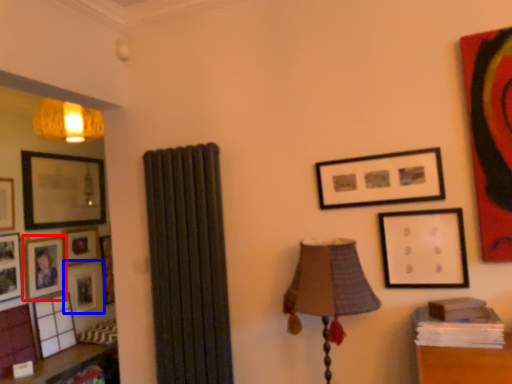
Question: Among these objects, which one is nearest to the camera, picture frame (highlighted by a red box) or picture frame (highlighted by a blue box)?

Choices:
 (A) picture frame
 (B) picture frame

Answer: (A)